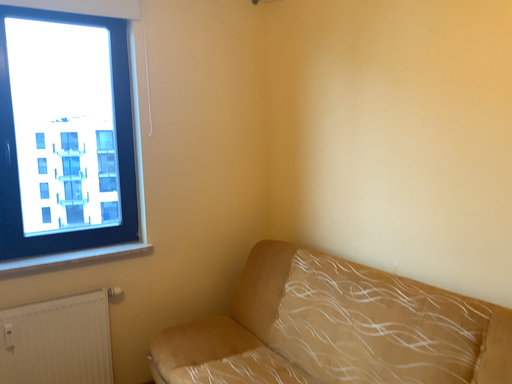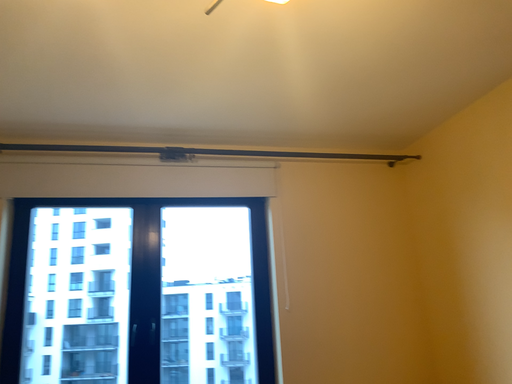
Question: Which way did the camera rotate in the video?

Choices:
 (A) rotated upward
 (B) rotated downward

Answer: (A)